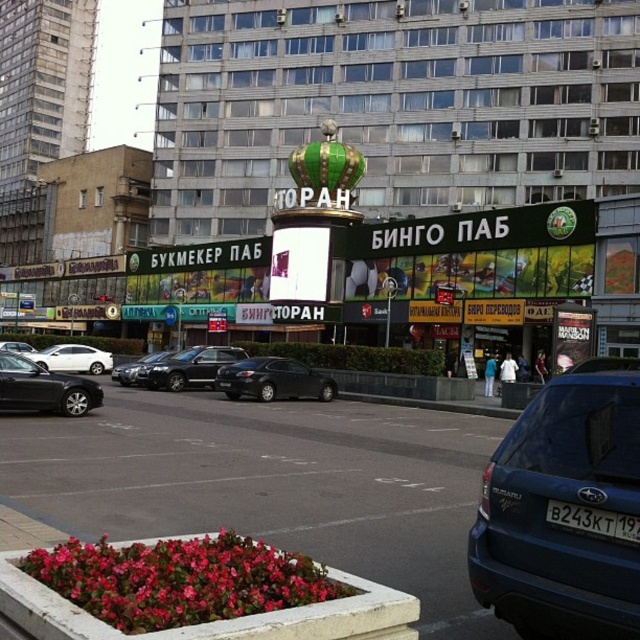
You are a delivery person who needs to park your white plastic license plate at lower right on the street. The satin black car at center is blocking the parking spot. Can you move the car to access the parking spot?

The satin black car at center is further to the viewer than the white plastic license plate at lower right, so the car is closer to you. You would need to move the satin black car at center to access the parking spot where the white plastic license plate at lower right is located.

You are a delivery person who needs to park your 1.8 meters tall delivery van next to the satin black car at center and the white plastic license plate at lower right. Based on the scene, can your van fit in the space between them without hitting anything?

The satin black car at center is taller than the white plastic license plate at lower right. Since your van is 1.8 meters tall, you need to check the height clearance. If the lowest point of the satin black car at center is above 1.8 meters, then it should fit. However, without exact measurements, it is uncertain. Consider checking the actual space or looking for height restrictions.